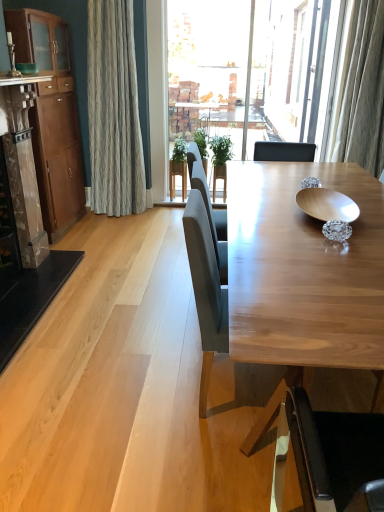
What are the coordinates of `vacant area situated to the left side of matte gray chair at center, the second chair viewed from the front` in the screenshot? It's located at (136, 399).